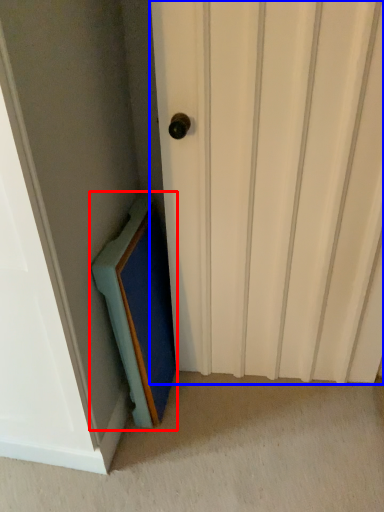
Question: Which point is closer to the camera, medicine cabinet (highlighted by a red box) or door (highlighted by a blue box)?

Choices:
 (A) medicine cabinet
 (B) door

Answer: (B)